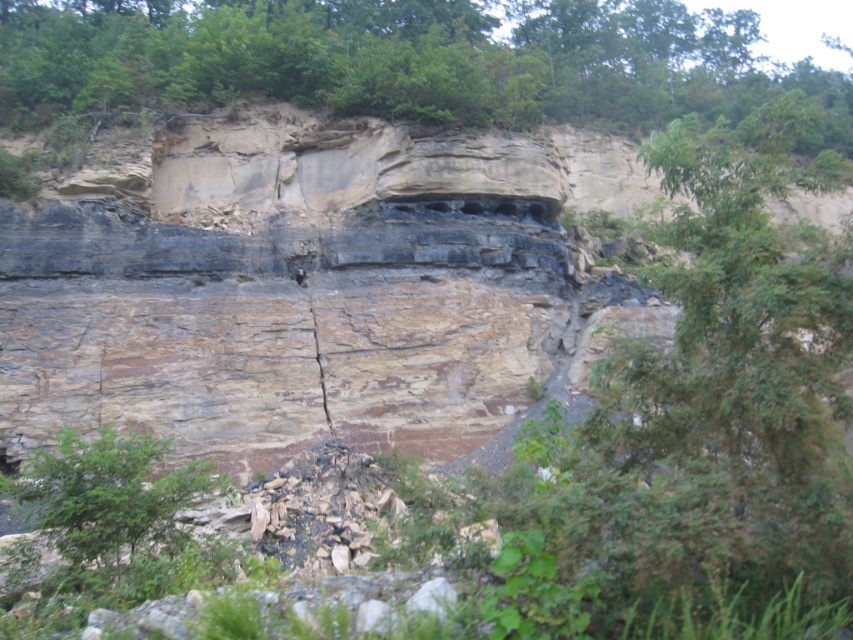
Question: Can you confirm if green leafy tree at upper center is smaller than green leafy tree at lower left?

Choices:
 (A) yes
 (B) no

Answer: (B)

Question: Among these points, which one is farthest from the camera?

Choices:
 (A) (71, 528)
 (B) (77, 19)

Answer: (B)

Question: Does green leafy tree at upper center appear on the left side of green leafy tree at lower left?

Choices:
 (A) no
 (B) yes

Answer: (A)

Question: Which object appears closest to the camera in this image?

Choices:
 (A) green leafy tree at lower left
 (B) green leafy tree at upper center

Answer: (A)

Question: Can you confirm if green leafy tree at upper center is positioned to the left of green leafy tree at lower left?

Choices:
 (A) no
 (B) yes

Answer: (A)